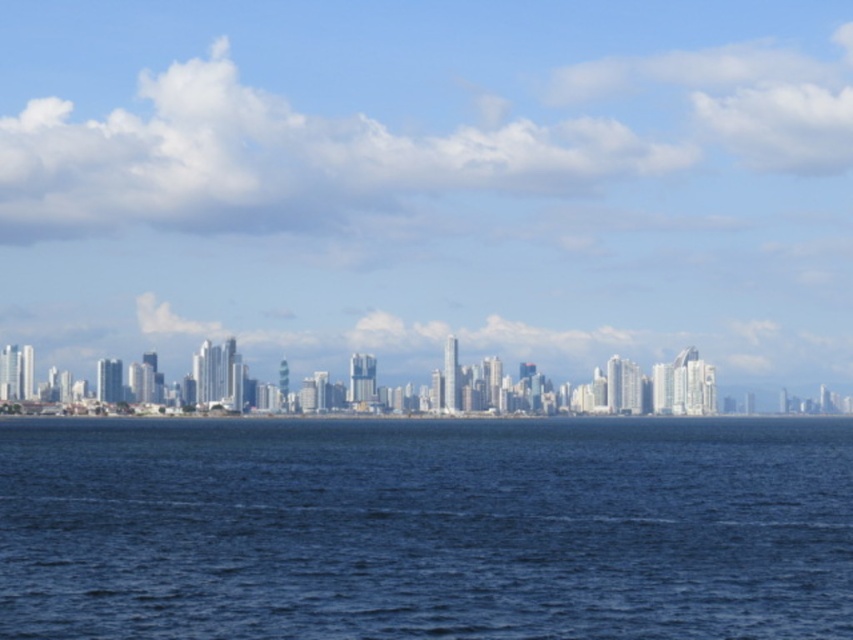
You are a drone operator planning to fly a drone between the transparent glass skyscrapers at center and the blue liquid water at center. The drone has a maximum flight distance of 300 feet. Can the drone safely complete the flight between them without exceeding its range?

The transparent glass skyscrapers at center and blue liquid water at center are 310.88 feet apart. Since the drone has a maximum flight distance of 300 feet, it cannot safely complete the flight between them without exceeding its range.

You are a photographer planning to capture the city skyline. You notice the transparent glass skyscrapers at center and the blue liquid water at center. Which object will occupy more space in your photo if you frame the shot to include both?

The transparent glass skyscrapers at center will occupy more space in the photo because they are larger in size compared to the blue liquid water at center.

You are standing on a pier overlooking the city skyline. You notice the transparent glass skyscrapers at center in the distance. If you want to reach them on foot, would you need to take a boat or can you walk directly to them?

The transparent glass skyscrapers at center are 647.11 meters away from the viewer. Since they are part of the city skyline across the water, you would need to take a boat or some form of water transportation to reach them as walking directly is not possible over the water.